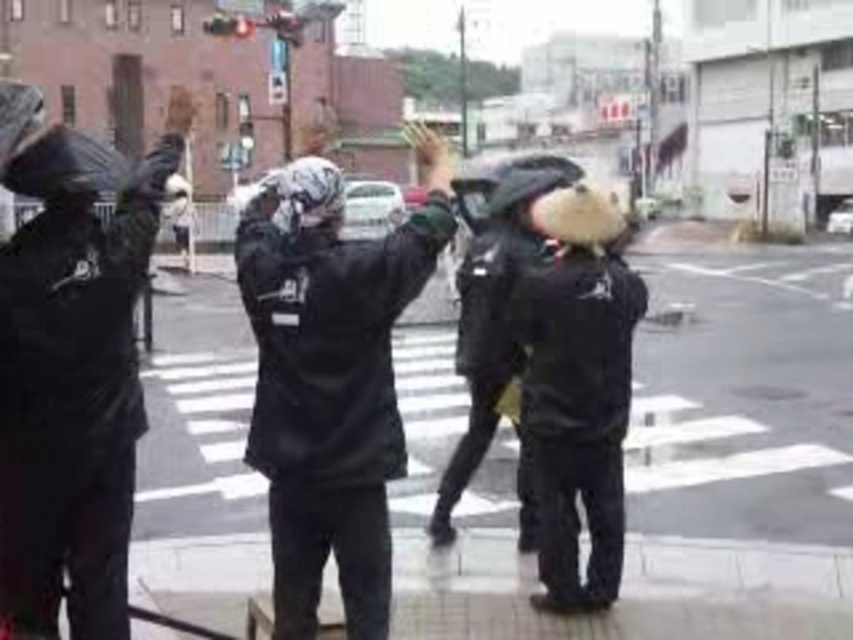
You are a delivery person who needs to cross the street to deliver a package. You see two points marked as point (86, 184). Are these points close enough for you to safely cross between them without needing to walk too far?

The points are 3.92 meters apart, so yes, they are close enough for you to safely cross between them without needing to walk too far.

You are standing at the center of the pedestrian crossing and want to move to the matte black jacket at left. Which direction should you go?

Since the matte black jacket at left is located at point (68, 371), you should move to the left to reach it.